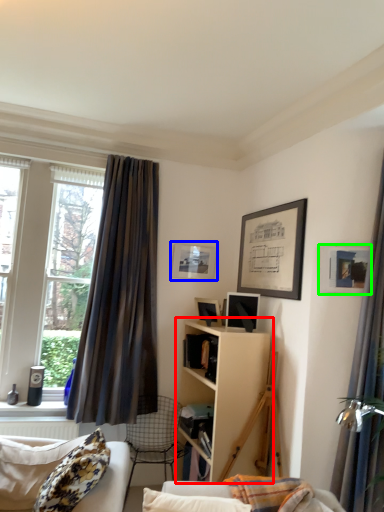
Question: Which is nearer to the shelf (highlighted by a red box)? picture frame (highlighted by a blue box) or picture frame (highlighted by a green box).

Choices:
 (A) picture frame
 (B) picture frame

Answer: (B)